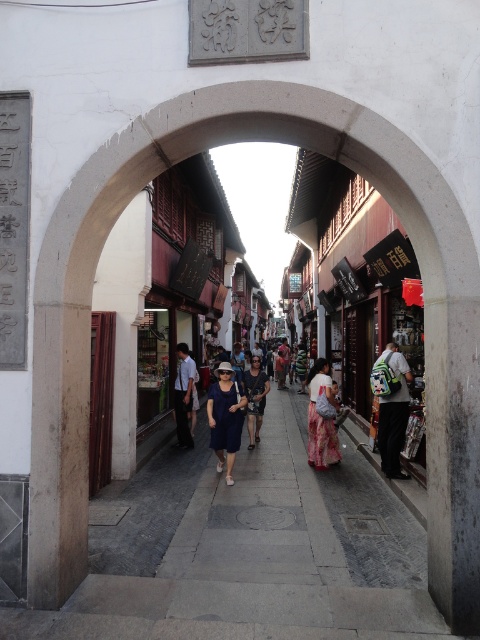
Who is positioned more to the right, gray stone pavement at center or blue cotton dress at center?

blue cotton dress at center

Is gray stone pavement at center to the right of blue cotton dress at center from the viewer's perspective?

In fact, gray stone pavement at center is to the left of blue cotton dress at center.

Where is `gray stone pavement at center`? This screenshot has height=640, width=480. gray stone pavement at center is located at coordinates (252, 554).

Where is `gray stone pavement at center`? The width and height of the screenshot is (480, 640). gray stone pavement at center is located at coordinates (252, 554).

Is gray stone pavement at center in front of floral silk dress at center?

Yes, gray stone pavement at center is closer to the viewer.

Which is above, gray stone pavement at center or floral silk dress at center?

Positioned higher is floral silk dress at center.

Does point (301, 468) come in front of point (312, 460)?

No.

Locate an element on the screen. Image resolution: width=480 pixels, height=640 pixels. gray stone pavement at center is located at coordinates (252, 554).

Between point (323, 380) and point (243, 380), which one is positioned in front?

Point (323, 380) is more forward.

What do you see at coordinates (321, 419) in the screenshot?
I see `floral silk dress at center` at bounding box center [321, 419].

What are the coordinates of `floral silk dress at center` in the screenshot? It's located at (321, 419).